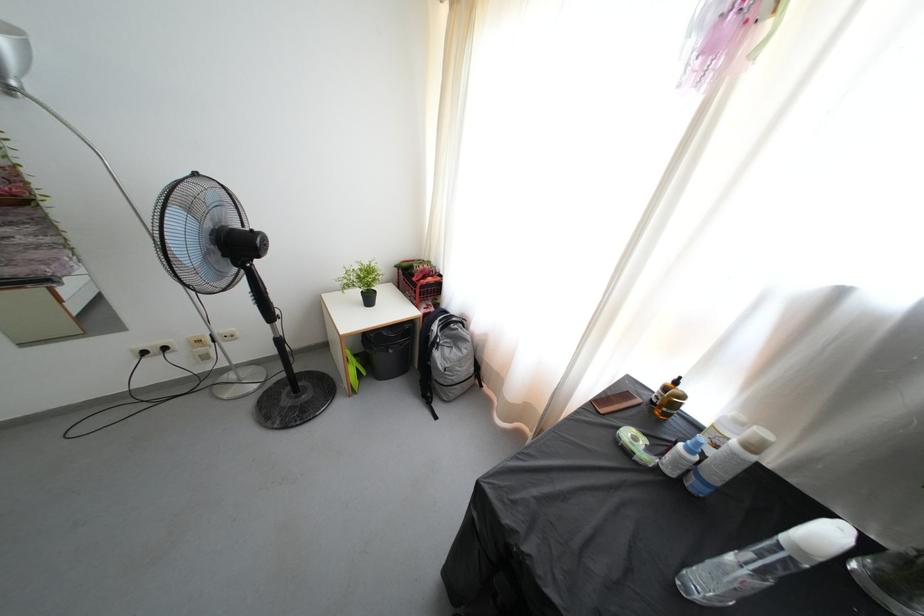
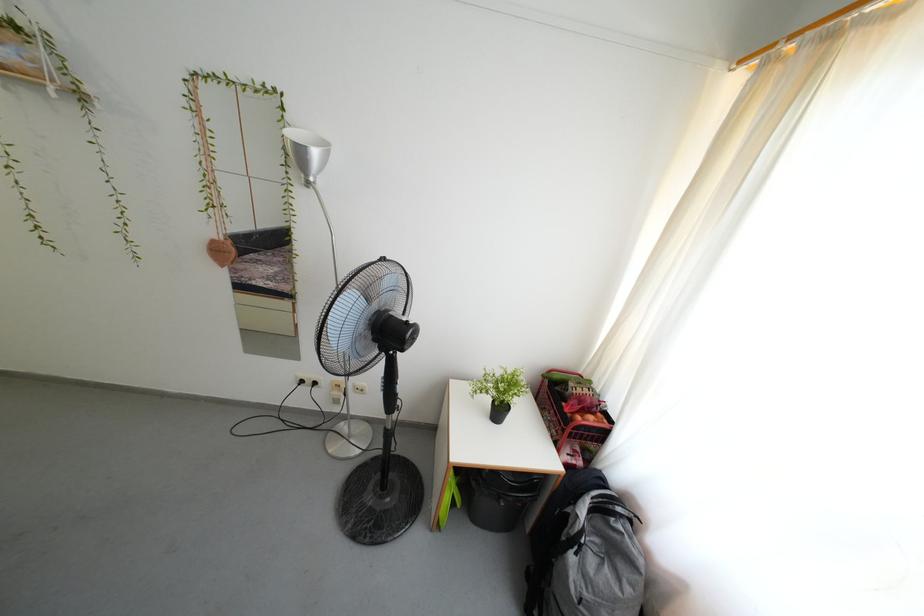
Question: How did the camera likely rotate?

Choices:
 (A) Left
 (B) Right
 (C) Up
 (D) Down

Answer: (A)